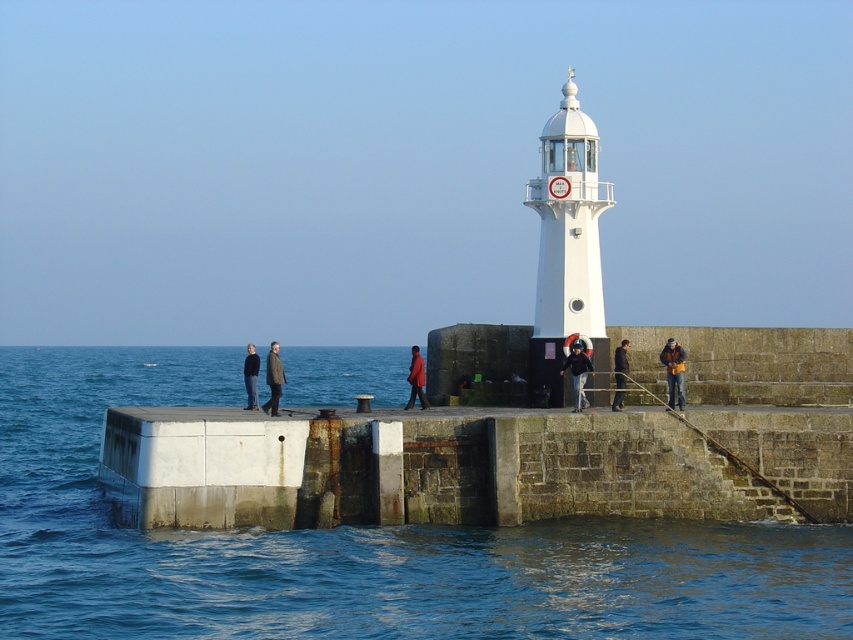
You are standing on the pier and want to borrow a jacket from either the dark brown leather jacket at lower right or the matte red coat at center. If you are facing the lighthouse, which jacket is closer to your right hand side?

The dark brown leather jacket at lower right is to the right of matte red coat at center, so if you are facing the lighthouse, the dark brown leather jacket at lower right would be closer to your right side.

You are standing on the pier and want to hand a souvenir to someone wearing the dark brown leather jacket at lower right. You are currently near the matte red coat at center. Can you throw the souvenir directly to them without leaving your spot?

The distance between the dark brown leather jacket at lower right and the matte red coat at center is 18.19 feet. Throwing a souvenir that far might be challenging for most people, so it is not advisable to attempt it from your current position.